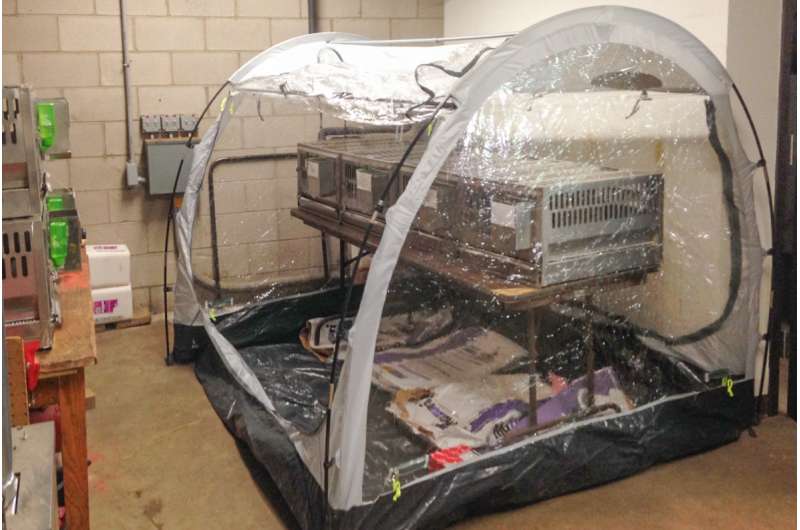
Image resolution: width=800 pixels, height=530 pixels. What are the coordinates of `jali` in the screenshot? It's located at (12, 258).